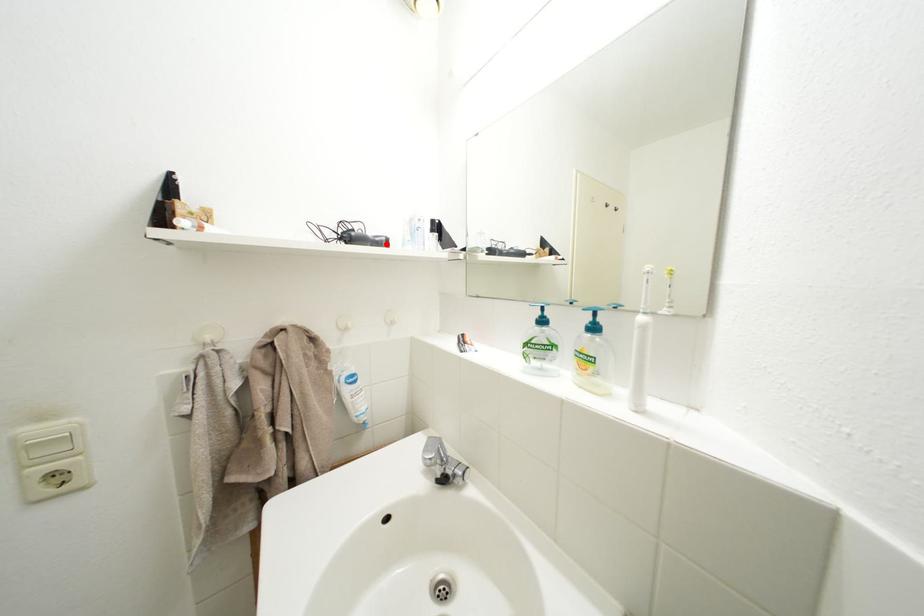
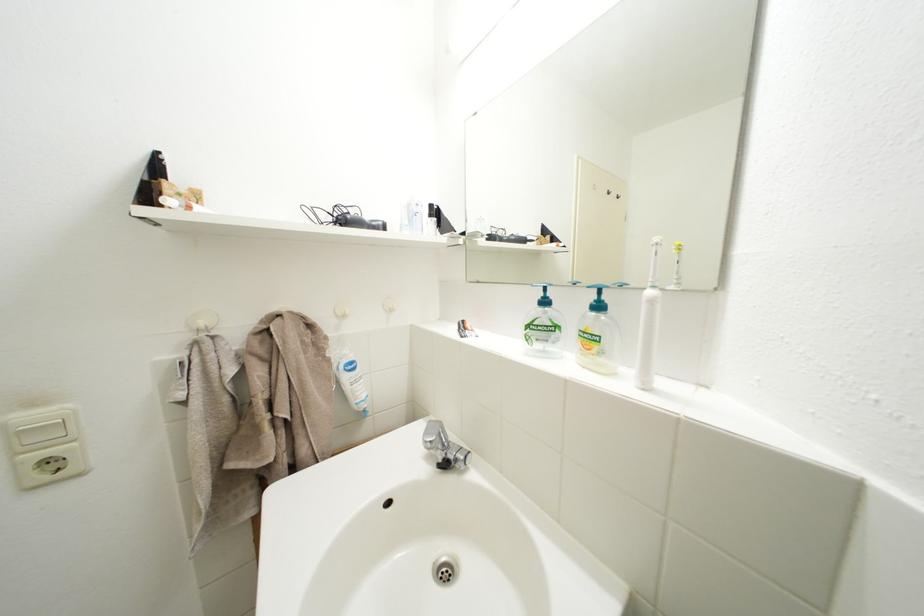
In the second image, find the point that corresponds to the highlighted location in the first image.

(383, 228)